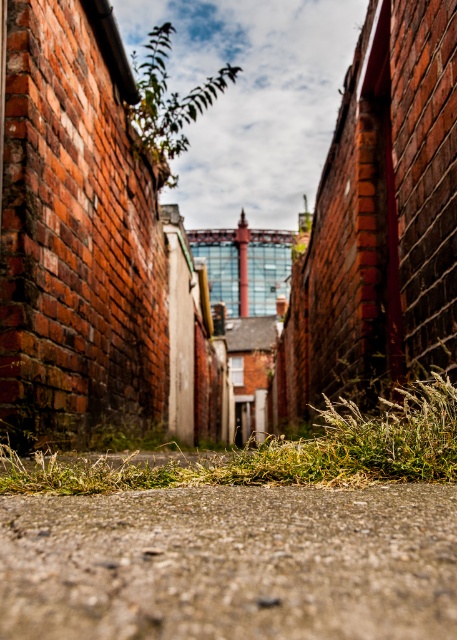
Who is lower down, green grass at bottom or green leafy plant at upper center?

green grass at bottom is lower down.

Measure the distance between green grass at bottom and green leafy plant at upper center.

green grass at bottom and green leafy plant at upper center are 5.33 meters apart.

Locate an element on the screen. Image resolution: width=457 pixels, height=640 pixels. green grass at bottom is located at coordinates (282, 452).

Can you confirm if gray concrete ground at center is positioned below green leafy plant at upper center?

Yes, gray concrete ground at center is below green leafy plant at upper center.

The image size is (457, 640). Find the location of `gray concrete ground at center`. gray concrete ground at center is located at coordinates (230, 563).

Who is more distant from viewer, (412, 627) or (152, 115)?

The point (152, 115) is behind.

Identify the location of gray concrete ground at center. This screenshot has height=640, width=457. (230, 563).

Which of these two, gray concrete ground at center or green grass at bottom, stands taller?

green grass at bottom

What do you see at coordinates (230, 563) in the screenshot? The width and height of the screenshot is (457, 640). I see `gray concrete ground at center` at bounding box center [230, 563].

From the picture: Who is more forward, (217,556) or (451,468)?

Point (217,556) is in front.

This screenshot has width=457, height=640. I want to click on gray concrete ground at center, so click(x=230, y=563).